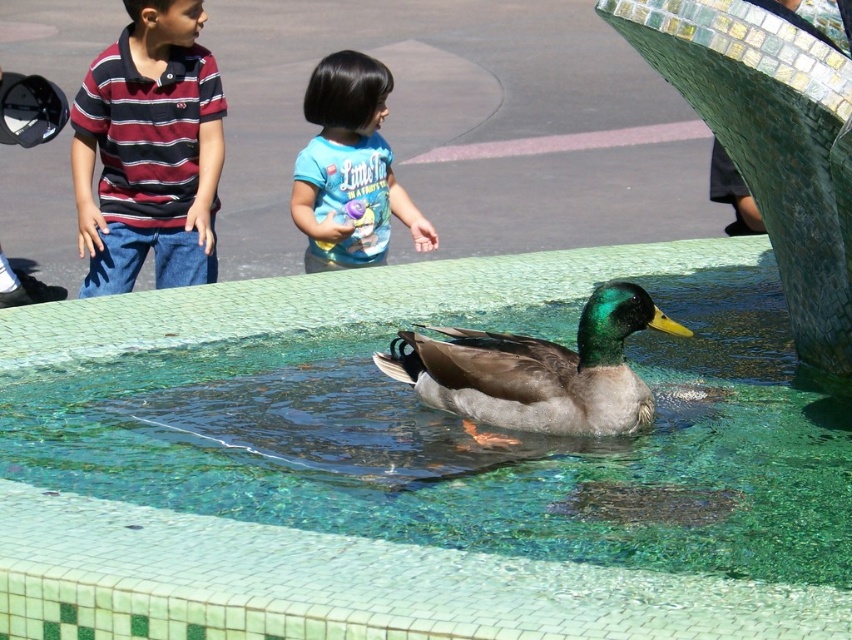
You are a photographer trying to capture both the striped cotton shirt at upper left and the green glossy duck at center in a single frame. Which object should you focus on first if you want to ensure both are in focus?

The striped cotton shirt at upper left is bigger than the green glossy duck at center, so focusing on the larger object first will help ensure both are in focus.

You are a photographer standing in the park. You want to take a photo of the striped cotton shirt at upper left and the green mosaic swimming pool at center. Which object should be placed on the left side of your photo?

The striped cotton shirt at upper left should be placed on the left side of your photo because it is to the left of the green mosaic swimming pool at center.